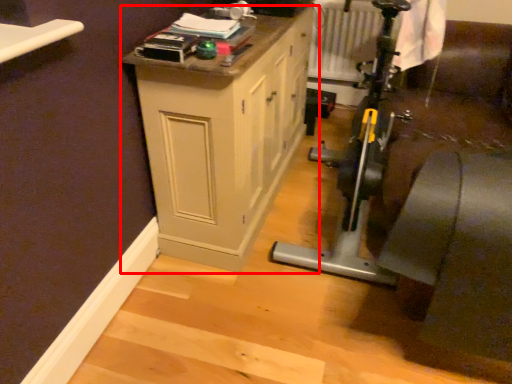
Question: Observing the image, what is the correct spatial positioning of cabinetry (annotated by the red box) in reference to radiator?

Choices:
 (A) right
 (B) left

Answer: (B)